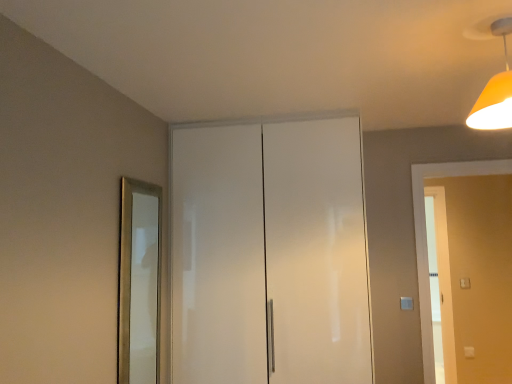
Question: Is gold metallic mirror at left wider or thinner than white glossy cabinet at center?

Choices:
 (A) thin
 (B) wide

Answer: (A)

Question: In terms of height, does gold metallic mirror at left look taller or shorter compared to white glossy cabinet at center?

Choices:
 (A) tall
 (B) short

Answer: (B)

Question: Estimate the real-world distances between objects in this image. Which object is farther from the orange matte light fixture at upper right?

Choices:
 (A) white glossy door at right
 (B) gold metallic mirror at left
 (C) white glossy cabinet at center

Answer: (B)

Question: Based on their relative distances, which object is nearer to the orange matte light fixture at upper right?

Choices:
 (A) gold metallic mirror at left
 (B) white glossy cabinet at center
 (C) white glossy door at right

Answer: (B)